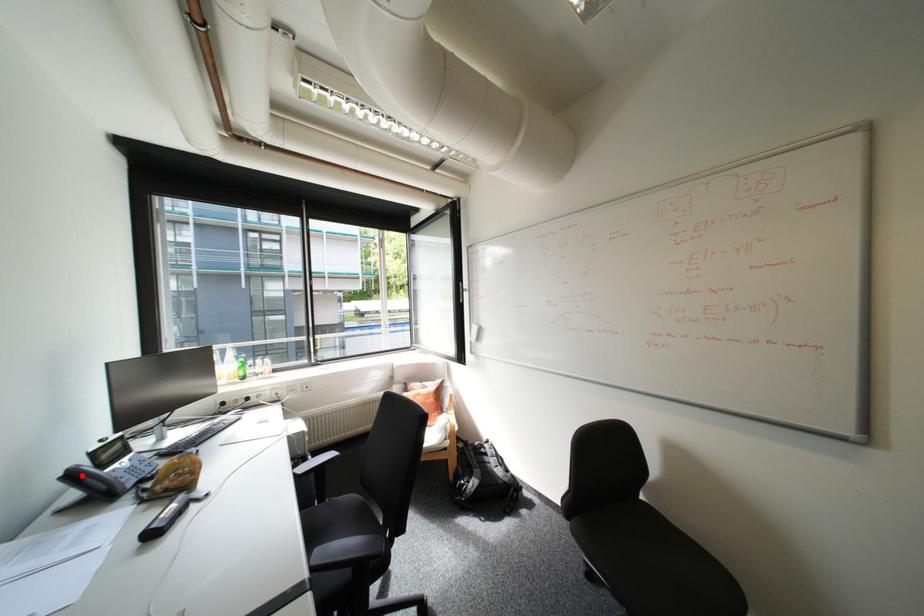
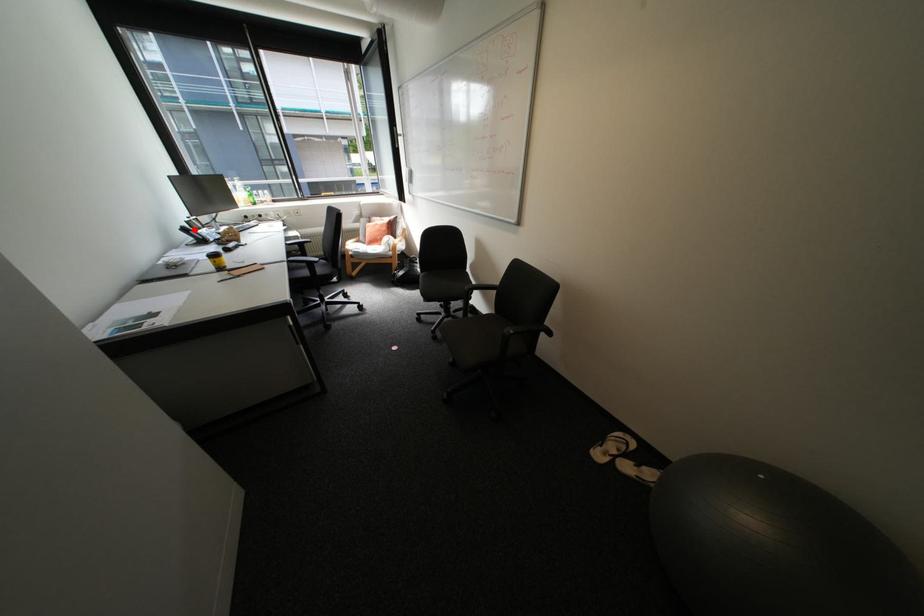
I am providing you with two images of the same scene from different viewpoints. A red point is marked on the first image and another point is marked on the second image. Does the point marked in image1 correspond to the same location as the one in image2?

Yes